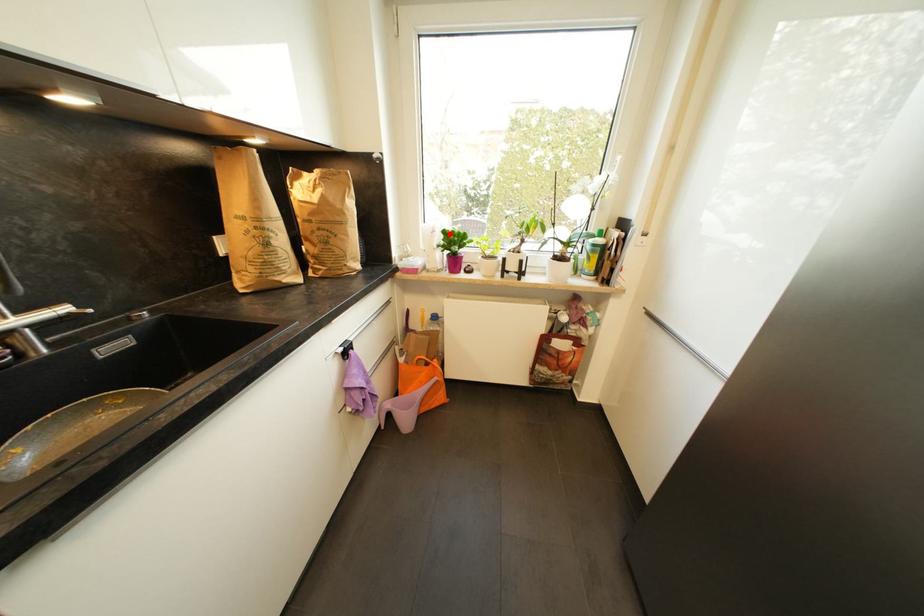
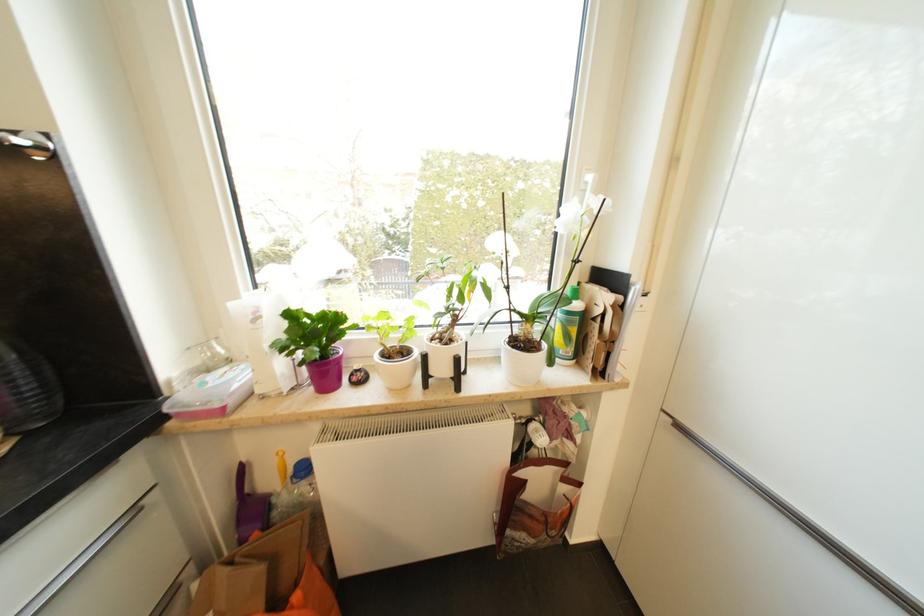
In the second image, find the point that corresponds to the highlighted location in the first image.

(295, 317)